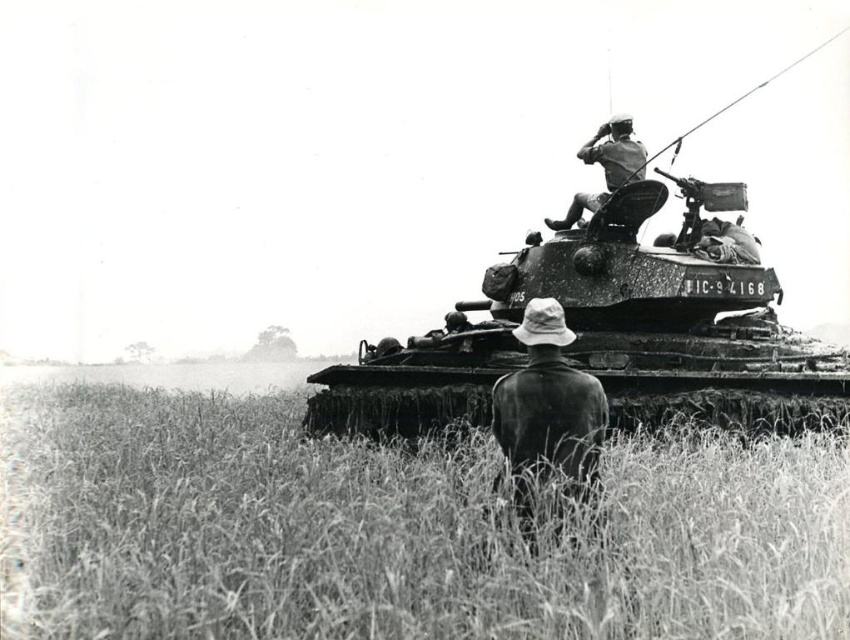
You are a soldier standing 1.6 meters tall. You want to pick up the dark brown leather hat at center. Can you reach it without climbing?

The dark brown leather hat at center is 3.84 meters away from the viewer. Since the hat is on the ground and the distance is greater than the soldier can reach while standing, the soldier cannot pick it up without moving closer or using a tool.

What is located at the coordinates point [548,410] in the image?

The point [548,410] indicates a dark brown leather hat at center.